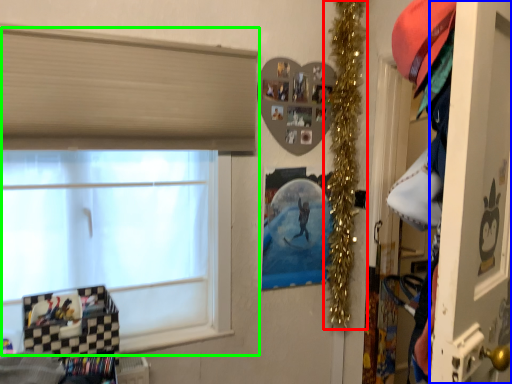
Question: Estimate the real-world distances between objects in this image. Which object is closer to christmas decoration (highlighted by a red box), screen door (highlighted by a blue box) or window (highlighted by a green box)?

Choices:
 (A) screen door
 (B) window

Answer: (B)